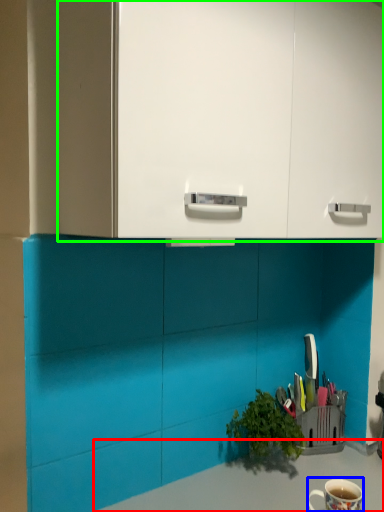
Question: Based on their relative distances, which object is farther from counter top (highlighted by a red box)? Choose from coffee cup (highlighted by a blue box) and dresser (highlighted by a green box).

Choices:
 (A) coffee cup
 (B) dresser

Answer: (B)